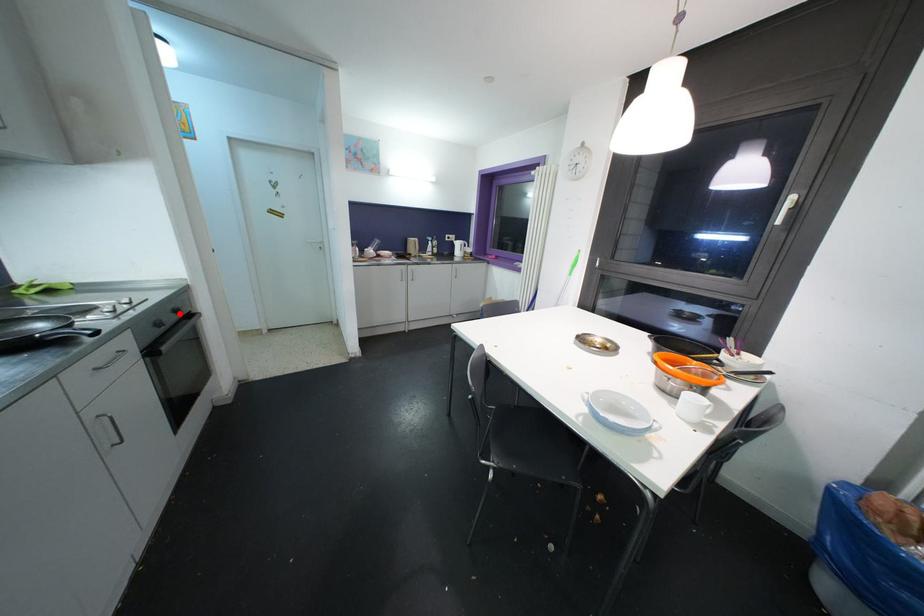
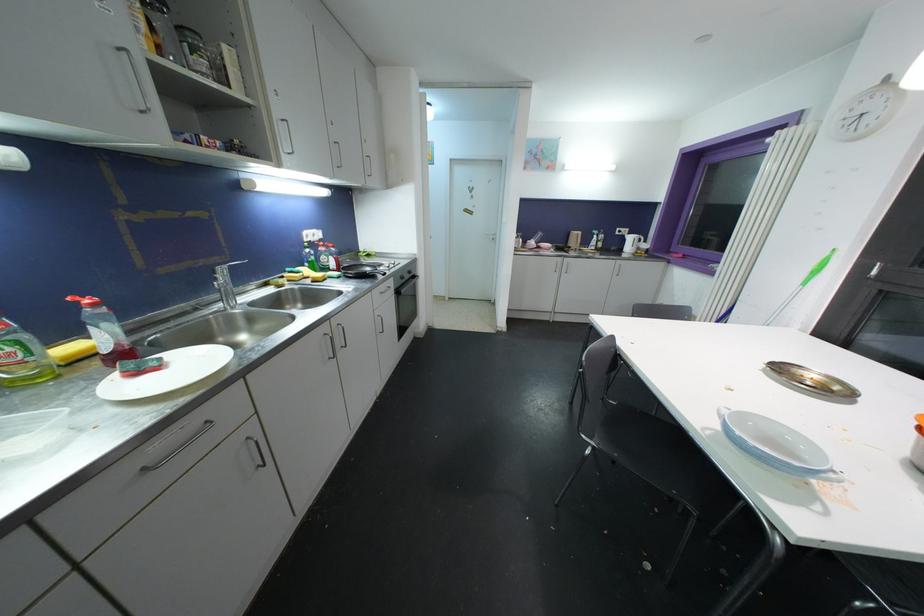
In the second image, find the point that corresponds to the highlighted location in the first image.

(412, 275)